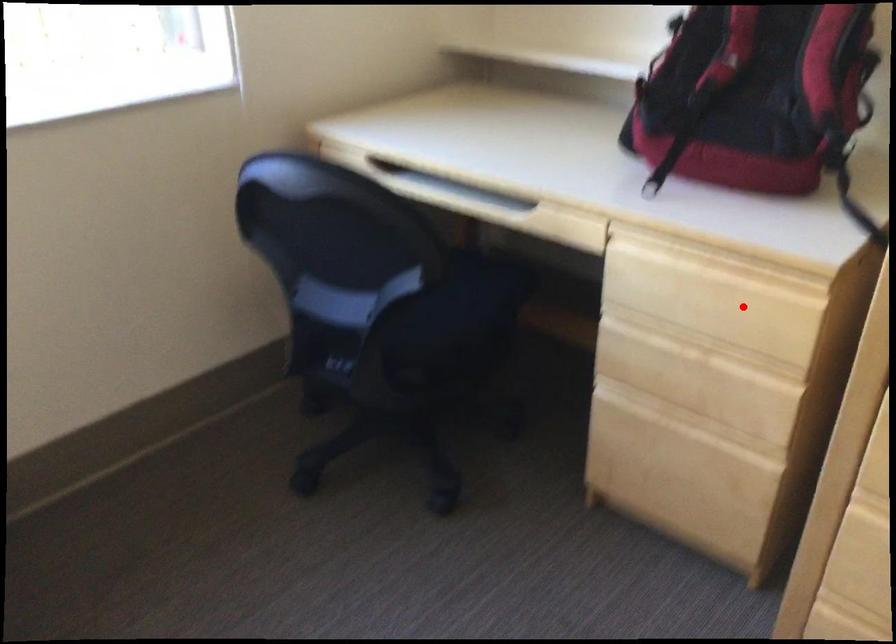
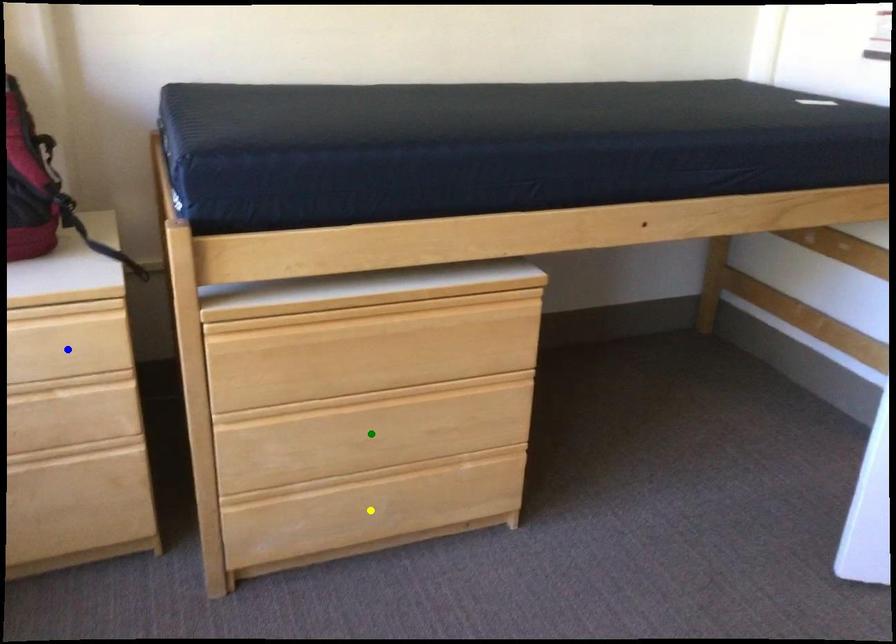
Question: I am providing you with two images of the same scene from different viewpoints. A red point is marked on the first image. You are given multiple points on the second image. In image 2, which mark is for the same physical point as the one in image 1?

Choices:
 (A) yellow point
 (B) blue point
 (C) green point

Answer: (B)